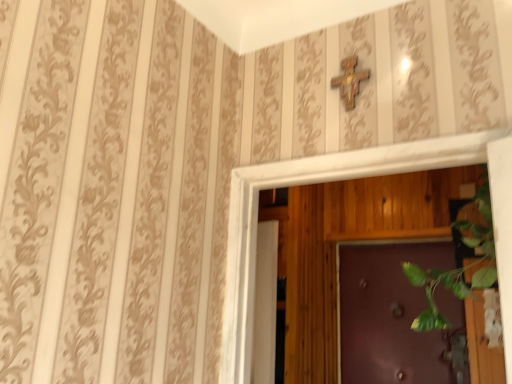
The image size is (512, 384). I want to click on purple glossy door at center, so click(x=389, y=316).

The height and width of the screenshot is (384, 512). What do you see at coordinates (389, 316) in the screenshot? I see `purple glossy door at center` at bounding box center [389, 316].

What do you see at coordinates (349, 81) in the screenshot? I see `wooden cross at upper center` at bounding box center [349, 81].

Find the location of a particular element. The height and width of the screenshot is (384, 512). wooden cross at upper center is located at coordinates (349, 81).

Identify the location of purple glossy door at center. This screenshot has height=384, width=512. (389, 316).

Would you say wooden cross at upper center is to the left or to the right of purple glossy door at center in the picture?

wooden cross at upper center is to the left of purple glossy door at center.

Who is more distant, wooden cross at upper center or purple glossy door at center?

purple glossy door at center is further away from the camera.

Which is in front, point (345, 95) or point (391, 295)?

Point (345, 95)

From the image's perspective, is wooden cross at upper center beneath purple glossy door at center?

No, from the image's perspective, wooden cross at upper center is not below purple glossy door at center.

From a real-world perspective, which is physically above, wooden cross at upper center or purple glossy door at center?

In real-world perspective, wooden cross at upper center is above.

In terms of width, does wooden cross at upper center look wider or thinner when compared to purple glossy door at center?

In the image, wooden cross at upper center appears to be more narrow than purple glossy door at center.

From their relative heights in the image, would you say wooden cross at upper center is taller or shorter than purple glossy door at center?

Clearly, wooden cross at upper center is shorter compared to purple glossy door at center.

Between wooden cross at upper center and purple glossy door at center, which one has smaller size?

wooden cross at upper center.

Is purple glossy door at center a part of wooden cross at upper center?

No, wooden cross at upper center does not contain purple glossy door at center.

Is wooden cross at upper center positioned far away from purple glossy door at center?

Absolutely, wooden cross at upper center is distant from purple glossy door at center.

Is wooden cross at upper center oriented away from purple glossy door at center?

Yes, wooden cross at upper center is positioned with its back facing purple glossy door at center.

What's the angular difference between wooden cross at upper center and purple glossy door at center's facing directions?

There is a 0.379-degree angle between the facing directions of wooden cross at upper center and purple glossy door at center.

Identify the location of cross that is on the left side of purple glossy door at center. (349, 81).

Consider the image. Is purple glossy door at center at the left side of wooden cross at upper center?

In fact, purple glossy door at center is to the right of wooden cross at upper center.

Considering the positions of objects purple glossy door at center and wooden cross at upper center in the image provided, who is in front, purple glossy door at center or wooden cross at upper center?

wooden cross at upper center is closer to the camera.

Does point (447, 336) come closer to viewer compared to point (354, 63)?

No, it is behind (354, 63).

From the image's perspective, is purple glossy door at center located above or below wooden cross at upper center?

Clearly, from the image's perspective, purple glossy door at center is below wooden cross at upper center.

From a real-world perspective, which is physically below, purple glossy door at center or wooden cross at upper center?

In real-world perspective, purple glossy door at center is lower.

In the scene shown: Considering the sizes of objects purple glossy door at center and wooden cross at upper center in the image provided, who is wider, purple glossy door at center or wooden cross at upper center?

purple glossy door at center.

Which of these two, purple glossy door at center or wooden cross at upper center, stands taller?

purple glossy door at center.

Between purple glossy door at center and wooden cross at upper center, which one has larger size?

purple glossy door at center.

Does purple glossy door at center contain wooden cross at upper center?

Actually, wooden cross at upper center is outside purple glossy door at center.

Is purple glossy door at center touching wooden cross at upper center?

purple glossy door at center is not next to wooden cross at upper center, and they're not touching.

Does purple glossy door at center turn towards wooden cross at upper center?

Yes, purple glossy door at center is aimed at wooden cross at upper center.

How many degrees apart are the facing directions of purple glossy door at center and wooden cross at upper center?

Answer: 0.379 degrees separate the facing orientations of purple glossy door at center and wooden cross at upper center.

Measure the distance from purple glossy door at center to wooden cross at upper center.

A distance of 1.95 meters exists between purple glossy door at center and wooden cross at upper center.

Locate an element on the screen. The height and width of the screenshot is (384, 512). door behind the wooden cross at upper center is located at coordinates (389, 316).

Locate an element on the screen. The image size is (512, 384). cross above the purple glossy door at center (from a real-world perspective) is located at coordinates (349, 81).

Where is `door that appears behind the wooden cross at upper center`? door that appears behind the wooden cross at upper center is located at coordinates (389, 316).